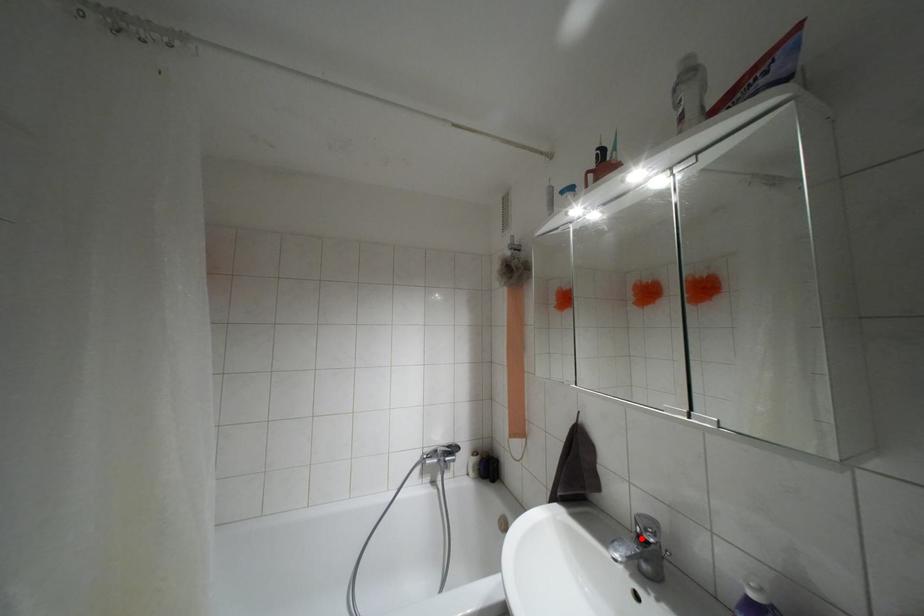
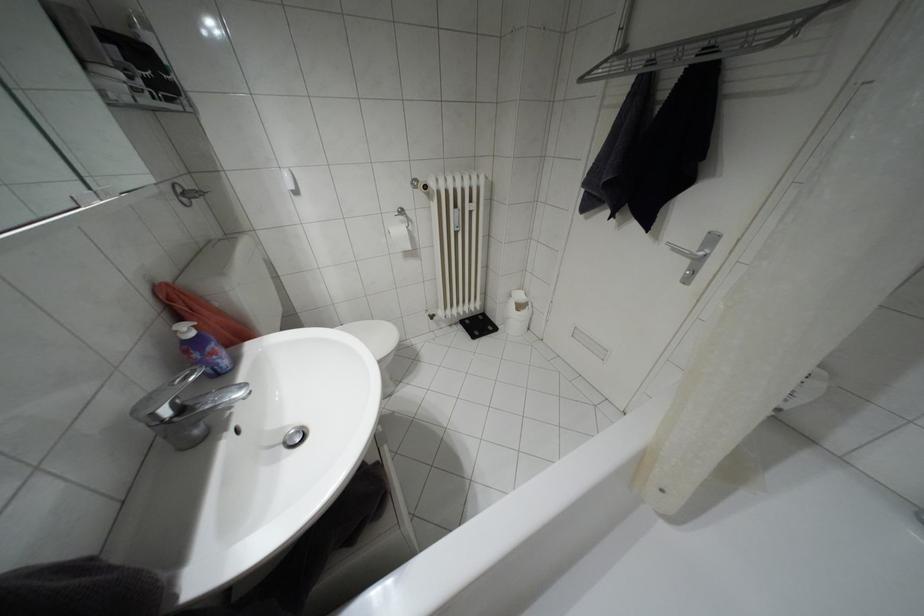
Where in the second image is the point corresponding to the highlighted location from the first image?

(180, 408)